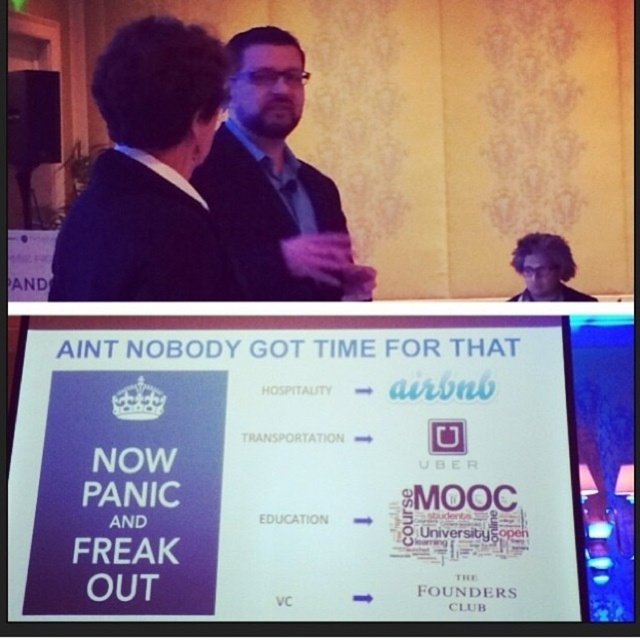
Question: From the image, what is the correct spatial relationship of matte black jacket at center in relation to black matte suit at upper left?

Choices:
 (A) right
 (B) left

Answer: (A)

Question: Which object is closer to the camera taking this photo?

Choices:
 (A) black matte suit at upper left
 (B) matte black jacket at center
 (C) dark curly hair at upper right

Answer: (A)

Question: Which object is farther from the camera taking this photo?

Choices:
 (A) matte black jacket at center
 (B) purple matte business suit at upper center

Answer: (B)

Question: Which point is closer to the camera?

Choices:
 (A) dark curly hair at upper right
 (B) matte black jacket at center
 (C) black matte suit at upper left
 (D) purple matte business suit at upper center

Answer: (C)

Question: Is black matte suit at upper left bigger than purple matte business suit at upper center?

Choices:
 (A) yes
 (B) no

Answer: (A)

Question: Can you confirm if matte black jacket at center is positioned above black matte suit at upper left?

Choices:
 (A) no
 (B) yes

Answer: (B)